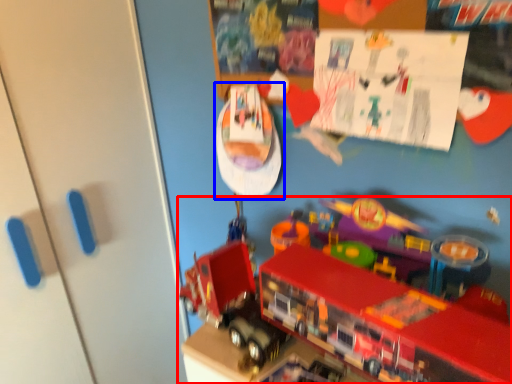
Question: Which object appears closest to the camera in this image, toy (highlighted by a red box) or toy (highlighted by a blue box)?

Choices:
 (A) toy
 (B) toy

Answer: (A)